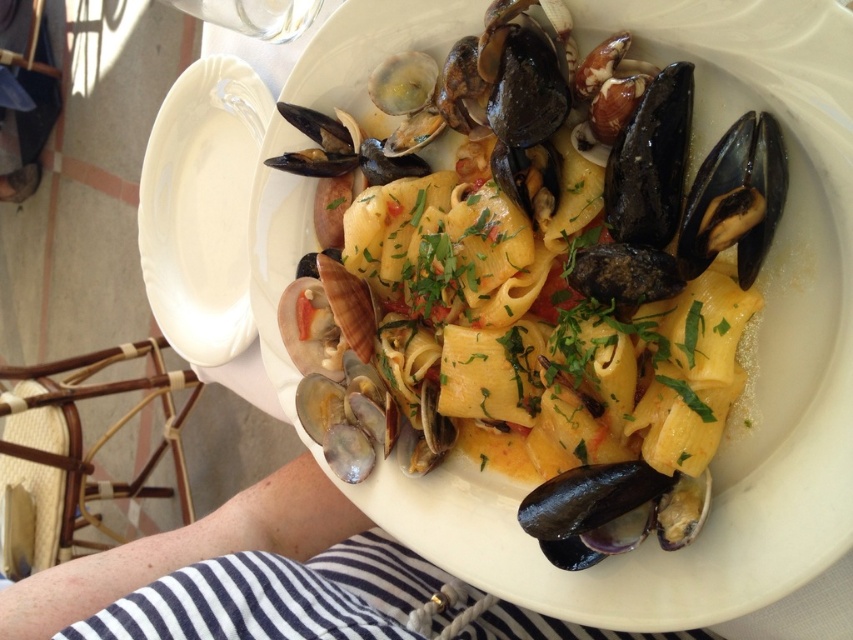
Question: Which point is closer to the camera?

Choices:
 (A) yellow matte pasta at center
 (B) white glossy plate at upper left

Answer: (A)

Question: Is yellow matte pasta at center bigger than white glossy plate at upper left?

Choices:
 (A) yes
 (B) no

Answer: (A)

Question: Does yellow matte pasta at center have a smaller size compared to white glossy plate at upper left?

Choices:
 (A) no
 (B) yes

Answer: (A)

Question: Which point is closer to the camera?

Choices:
 (A) (570, 564)
 (B) (190, 166)

Answer: (A)

Question: Is white glossy plate at upper left below shiny dark blue shell at bottom right?

Choices:
 (A) yes
 (B) no

Answer: (B)

Question: Estimate the real-world distances between objects in this image. Which object is closer to the shiny dark blue shell at bottom right?

Choices:
 (A) yellow matte pasta at center
 (B) white glossy plate at upper left

Answer: (A)